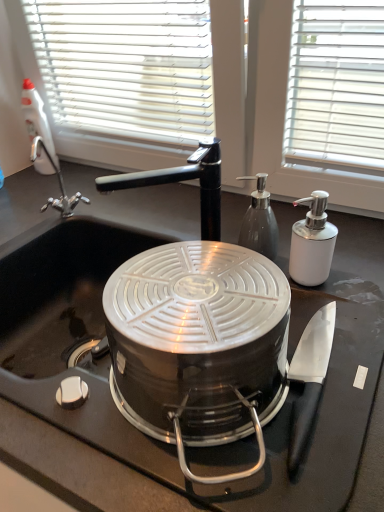
Question: Does black matte sink at center have a lesser height compared to white plastic spray bottle at upper left?

Choices:
 (A) yes
 (B) no

Answer: (B)

Question: From a real-world perspective, does black matte sink at center stand above white plastic spray bottle at upper left?

Choices:
 (A) no
 (B) yes

Answer: (A)

Question: Can you confirm if black matte sink at center is wider than white plastic spray bottle at upper left?

Choices:
 (A) yes
 (B) no

Answer: (A)

Question: Is black matte sink at center positioned behind white plastic spray bottle at upper left?

Choices:
 (A) yes
 (B) no

Answer: (B)

Question: From the image's perspective, is black matte sink at center below white plastic spray bottle at upper left?

Choices:
 (A) yes
 (B) no

Answer: (A)

Question: Considering the positions of white plastic spray bottle at upper left and black matte sink at center in the image, is white plastic spray bottle at upper left taller or shorter than black matte sink at center?

Choices:
 (A) tall
 (B) short

Answer: (B)

Question: In terms of width, does white plastic spray bottle at upper left look wider or thinner when compared to black matte sink at center?

Choices:
 (A) wide
 (B) thin

Answer: (B)

Question: Choose the correct answer: Is white plastic spray bottle at upper left inside black matte sink at center or outside it?

Choices:
 (A) inside
 (B) outside

Answer: (B)

Question: From the image's perspective, is white plastic spray bottle at upper left above or below black matte sink at center?

Choices:
 (A) above
 (B) below

Answer: (A)

Question: Is black matte sink at center inside or outside of white plastic spray bottle at upper left?

Choices:
 (A) outside
 (B) inside

Answer: (A)

Question: From the image's perspective, is black matte sink at center located above or below white plastic spray bottle at upper left?

Choices:
 (A) below
 (B) above

Answer: (A)

Question: Considering the relative positions of black matte sink at center and white plastic spray bottle at upper left in the image provided, is black matte sink at center to the left or to the right of white plastic spray bottle at upper left?

Choices:
 (A) left
 (B) right

Answer: (B)

Question: Looking at their shapes, would you say black matte sink at center is wider or thinner than white plastic spray bottle at upper left?

Choices:
 (A) wide
 (B) thin

Answer: (A)

Question: Considering the relative positions of white glossy soap dispenser at right, the first kitchen appliance positioned from the right, and black matte sink at center in the image provided, is white glossy soap dispenser at right, the first kitchen appliance positioned from the right, to the left or to the right of black matte sink at center?

Choices:
 (A) left
 (B) right

Answer: (B)

Question: Is point (321, 279) positioned closer to the camera than point (11, 282)?

Choices:
 (A) closer
 (B) farther

Answer: (A)